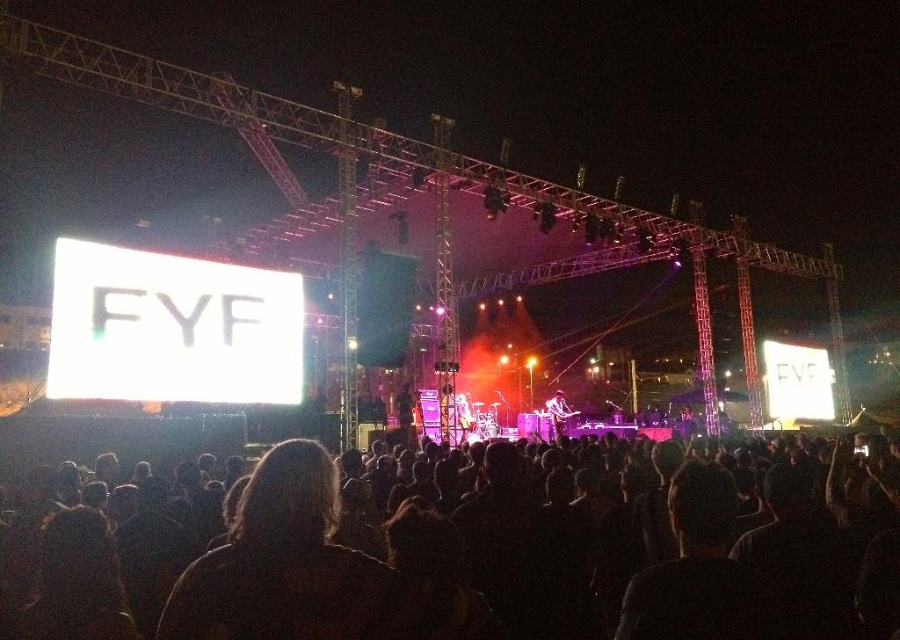
Question: Among these points, which one is nearest to the camera?

Choices:
 (A) (235, 612)
 (B) (550, 413)
 (C) (407, 424)
 (D) (353, 573)

Answer: (A)

Question: Is black matte crowd at center above black fabric at center?

Choices:
 (A) no
 (B) yes

Answer: (A)

Question: Among these points, which one is nearest to the camera?

Choices:
 (A) (262, 504)
 (B) (406, 388)
 (C) (559, 508)

Answer: (A)

Question: Can you confirm if black matte crowd at center is wider than shiny silver guitar at center?

Choices:
 (A) yes
 (B) no

Answer: (A)

Question: Is dark hair at center above shiny silver guitar at center?

Choices:
 (A) no
 (B) yes

Answer: (A)

Question: Among these points, which one is farthest from the camera?

Choices:
 (A) (258, 499)
 (B) (762, 493)
 (C) (554, 392)

Answer: (C)